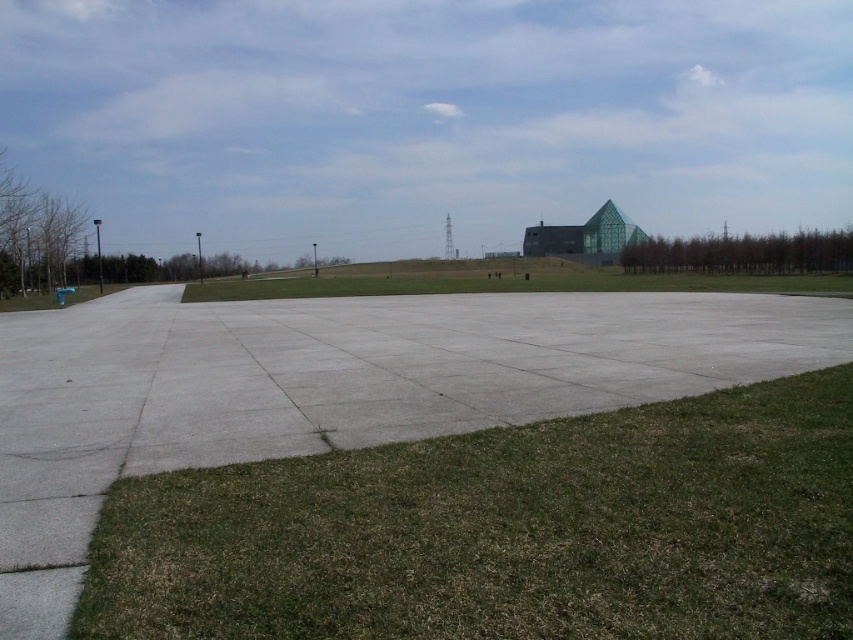
Question: Is the position of green grass at lower right more distant than that of green grass at center?

Choices:
 (A) no
 (B) yes

Answer: (A)

Question: Is green grass at lower right below green grass at center?

Choices:
 (A) no
 (B) yes

Answer: (B)

Question: Which point is closer to the camera taking this photo?

Choices:
 (A) (355, 476)
 (B) (207, 284)

Answer: (A)

Question: Among these points, which one is farthest from the camera?

Choices:
 (A) (372, 609)
 (B) (213, 300)

Answer: (B)

Question: Considering the relative positions of green grass at lower right and green grass at center in the image provided, where is green grass at lower right located with respect to green grass at center?

Choices:
 (A) right
 (B) left

Answer: (A)

Question: Which object appears farthest from the camera in this image?

Choices:
 (A) green grass at center
 (B) green grass at lower right

Answer: (A)